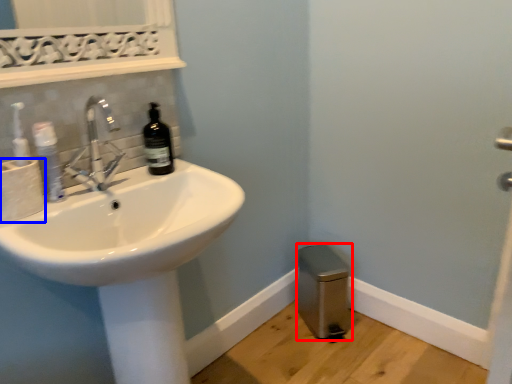
Question: Which point is further to the camera, bidet (highlighted by a red box) or toilet paper (highlighted by a blue box)?

Choices:
 (A) bidet
 (B) toilet paper

Answer: (A)